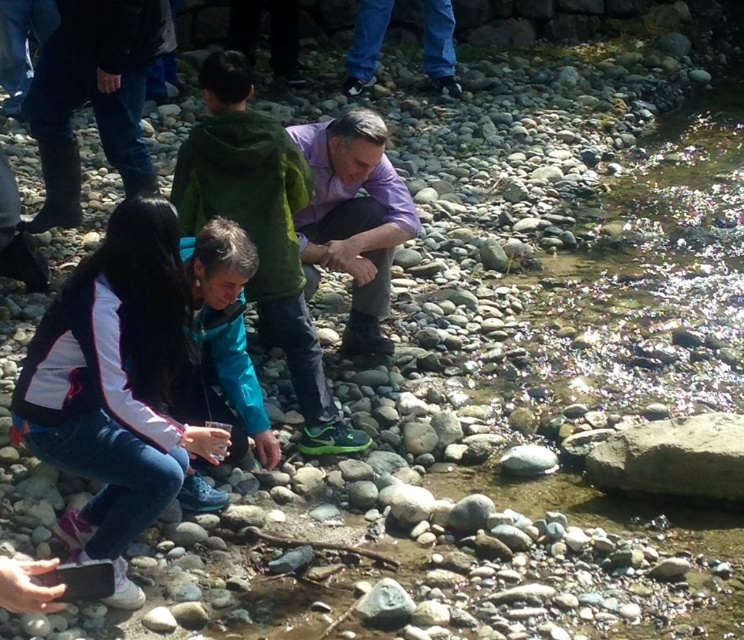
Can you confirm if dark blue jeans at upper left is positioned below purple cotton shirt at center?

Incorrect, dark blue jeans at upper left is not positioned below purple cotton shirt at center.

At what (x,y) coordinates should I click in order to perform the action: click on dark blue jeans at upper left. Please return your answer as a coordinate pair (x, y). Looking at the image, I should click on (94, 97).

What do you see at coordinates (94, 97) in the screenshot?
I see `dark blue jeans at upper left` at bounding box center [94, 97].

Does point (67, 28) come closer to viewer compared to point (202, 356)?

No, it is not.

At what (x,y) coordinates should I click in order to perform the action: click on dark blue jeans at upper left. Please return your answer as a coordinate pair (x, y). Image resolution: width=744 pixels, height=640 pixels. Looking at the image, I should click on (94, 97).

Who is more forward, (173, 465) or (173, 400)?

Point (173, 465) is in front.

Can you confirm if white matte jacket at lower left is positioned below teal fabric jacket at center?

Yes.

Between point (161, 417) and point (214, 228), which one is positioned behind?

Positioned behind is point (214, 228).

You are a GUI agent. You are given a task and a screenshot of the screen. Output one action in this format:
    pyautogui.click(x=<x>, y=<y>)
    Task: Click on the white matte jacket at lower left
    
    Given the screenshot: What is the action you would take?
    pyautogui.click(x=115, y=385)